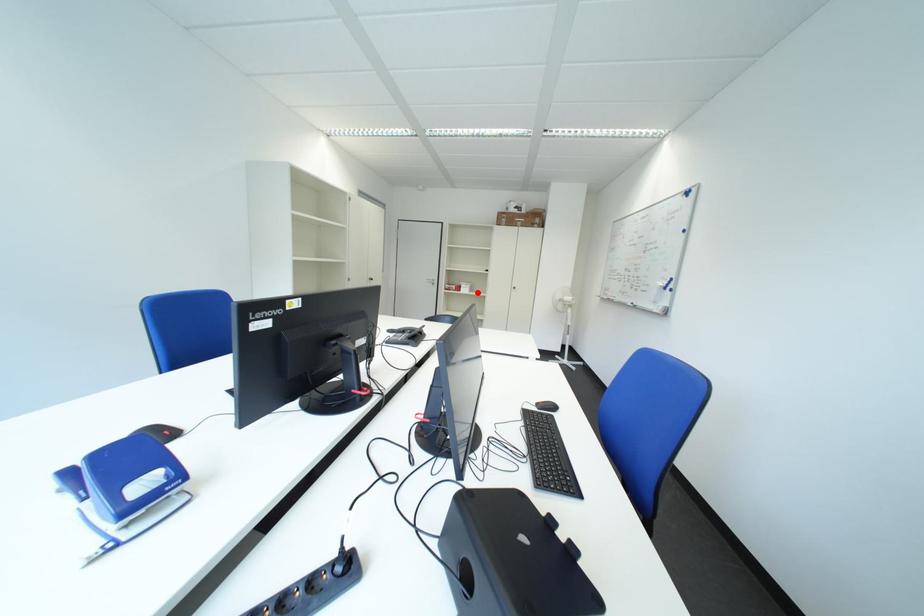
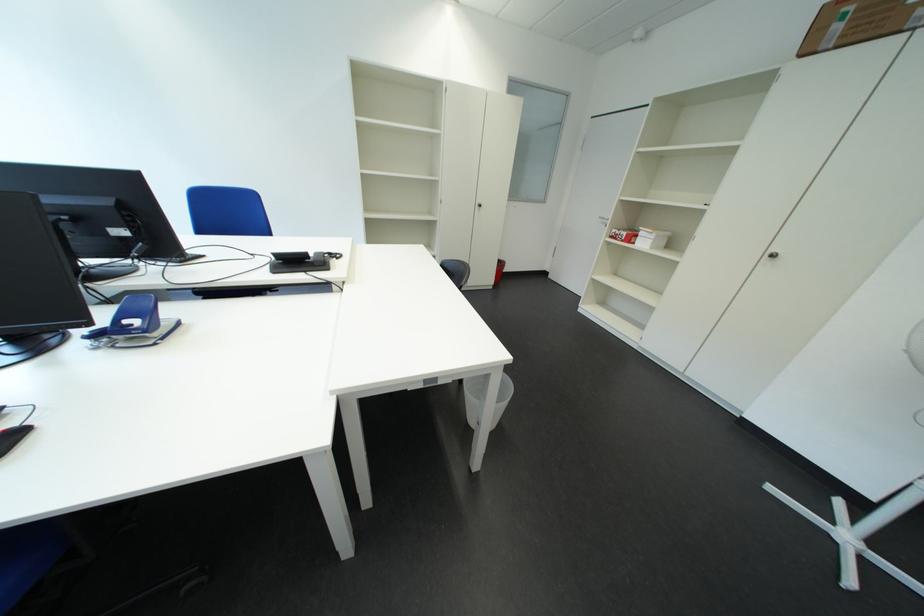
The point at the highlighted location is marked in the first image. Where is the corresponding point in the second image?

(657, 246)